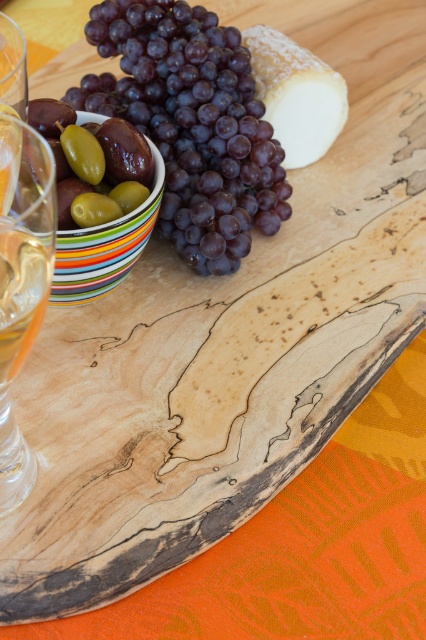
You are arranging a cheese platter and need to place a new fruit between the white creamy cheese at upper center and the green olive at center. Based on their positions, which object should the fruit be closer to?

The fruit should be closer to the green olive at center because the white creamy cheese at upper center is further away from the viewer, making the green olive at center the closer one.

You are arranging a picnic basket and need to know the order of items from front to back. Which item is closer to you between the shiny purple grapes at upper left and the clear glass wine glass at left?

The shiny purple grapes at upper left are closer to you because the clear glass wine glass at left is behind them.

Looking at this image, you are arranging a picnic basket and need to know which item is taller between the shiny purple grapes at upper left and the clear glass wine glass at left. Can you tell me which one is taller?

The shiny purple grapes at upper left is taller than the clear glass wine glass at left according to the description.